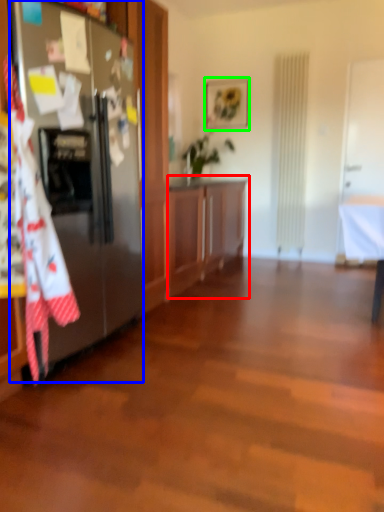
Question: Which object is the closest to the cabinetry (highlighted by a red box)? Choose among these: refrigerator (highlighted by a blue box) or picture frame (highlighted by a green box).

Choices:
 (A) refrigerator
 (B) picture frame

Answer: (A)